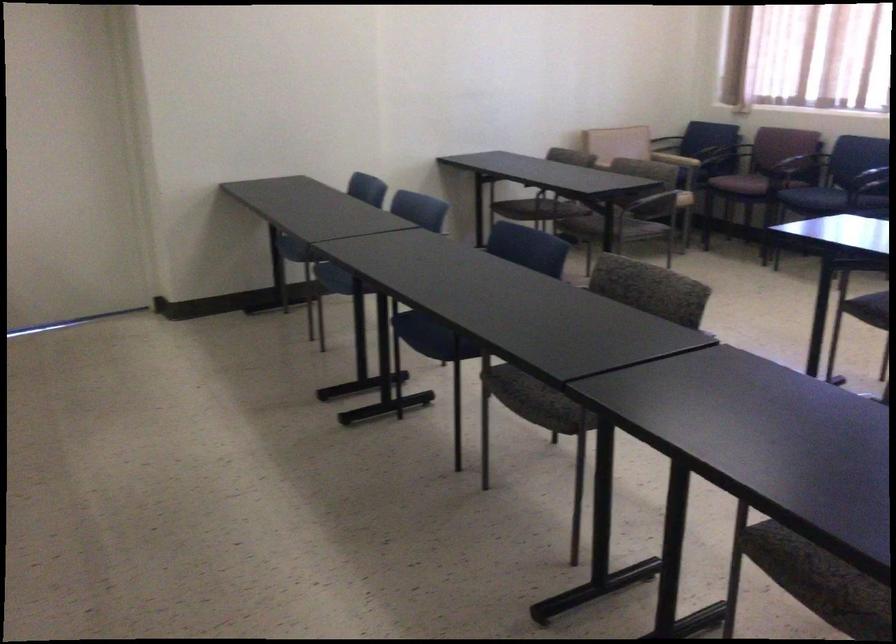
Find where to resting arm the purple chair armrest. Please return your answer as a coordinate pair (x, y).

(728, 153)